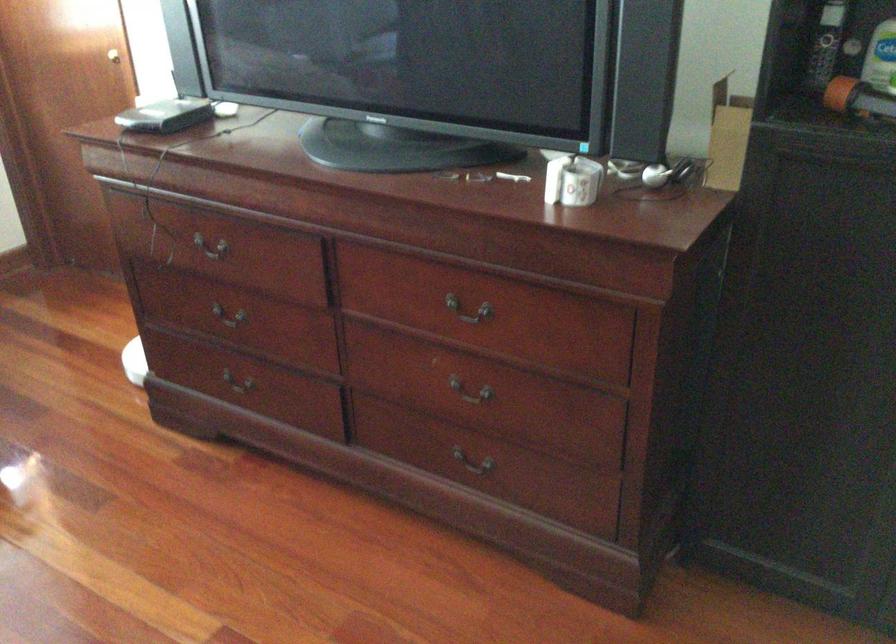
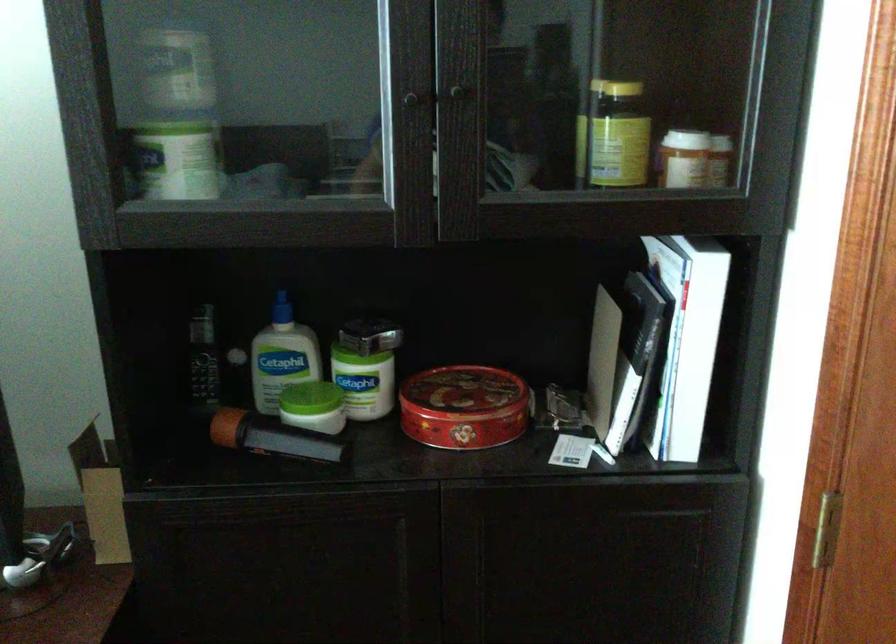
Question: The images are taken continuously from a first-person perspective. In which direction is your viewpoint rotating?

Choices:
 (A) Left
 (B) Right
 (C) Up
 (D) Down

Answer: (B)